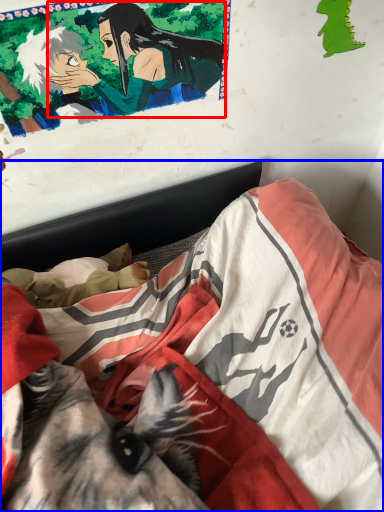
Question: Which object is closer to the camera taking this photo, woman (highlighted by a red box) or bed (highlighted by a blue box)?

Choices:
 (A) woman
 (B) bed

Answer: (B)